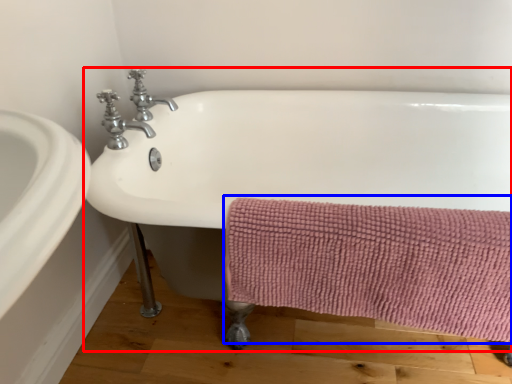
Question: Which object appears closest to the camera in this image, bathtub (highlighted by a red box) or bath towel (highlighted by a blue box)?

Choices:
 (A) bathtub
 (B) bath towel

Answer: (A)